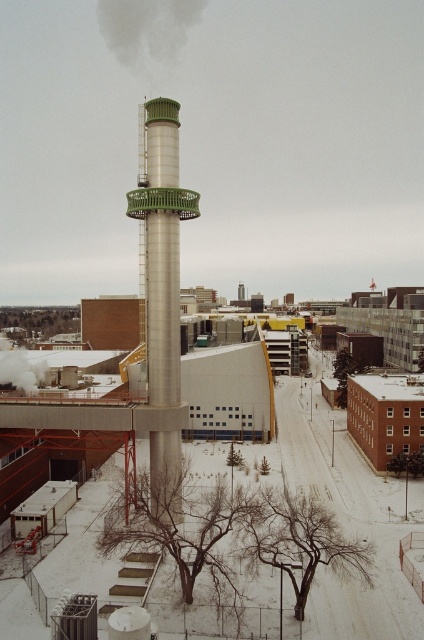
Question: Which point is closer to the camera taking this photo?

Choices:
 (A) (42, 369)
 (B) (159, 202)

Answer: (B)

Question: Which of the following is the closest to the observer?

Choices:
 (A) white smoke at center
 (B) gray matte smoke at upper center

Answer: (A)

Question: Considering the relative positions of silver metallic tower at center and white smoke at center in the image provided, where is silver metallic tower at center located with respect to white smoke at center?

Choices:
 (A) left
 (B) right

Answer: (B)

Question: Does gray matte smoke at upper center appear on the right side of white smoke at center?

Choices:
 (A) no
 (B) yes

Answer: (A)

Question: Estimate the real-world distances between objects in this image. Which object is closer to the gray matte smoke at upper center?

Choices:
 (A) white smoke at center
 (B) silver metallic tower at center

Answer: (A)

Question: Is gray matte smoke at upper center positioned before white smoke at center?

Choices:
 (A) no
 (B) yes

Answer: (A)